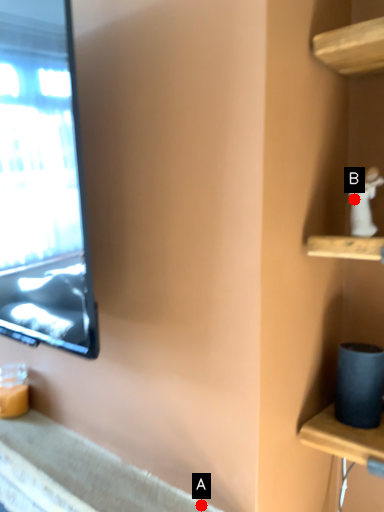
Question: Two points are circled on the image, labeled by A and B beside each circle. Which point is closer to the camera taking this photo?

Choices:
 (A) A is closer
 (B) B is closer

Answer: (A)